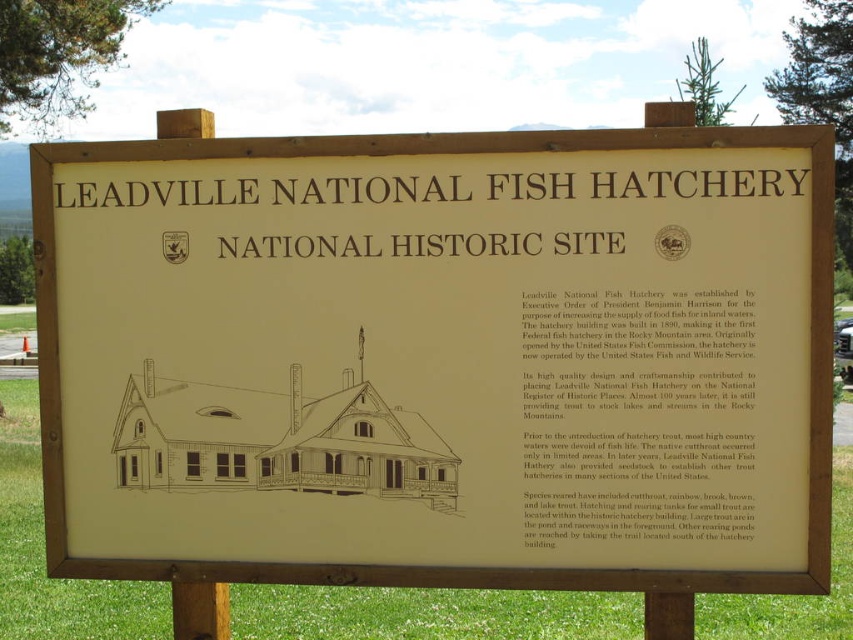
You are standing 10 feet away from the beige paper sign at center. Can you reach it without moving closer?

The beige paper sign at center is 12.21 feet away from the viewer, so you are currently 10 feet away. Since 10 feet is less than 12.21 feet, you are closer than the sign, meaning you can reach it without moving closer.

You are standing at the Leadville National Fish Hatchery signboard and notice two points marked on the illustration. If you were to walk directly toward the point labeled as point (718, 337), would you also be moving closer to the point labeled point (186, 394)?

Point (186, 394) is behind point (718, 337). Therefore, walking toward point (718, 337) would also bring you closer to point (186, 394) since it is located behind the first point.